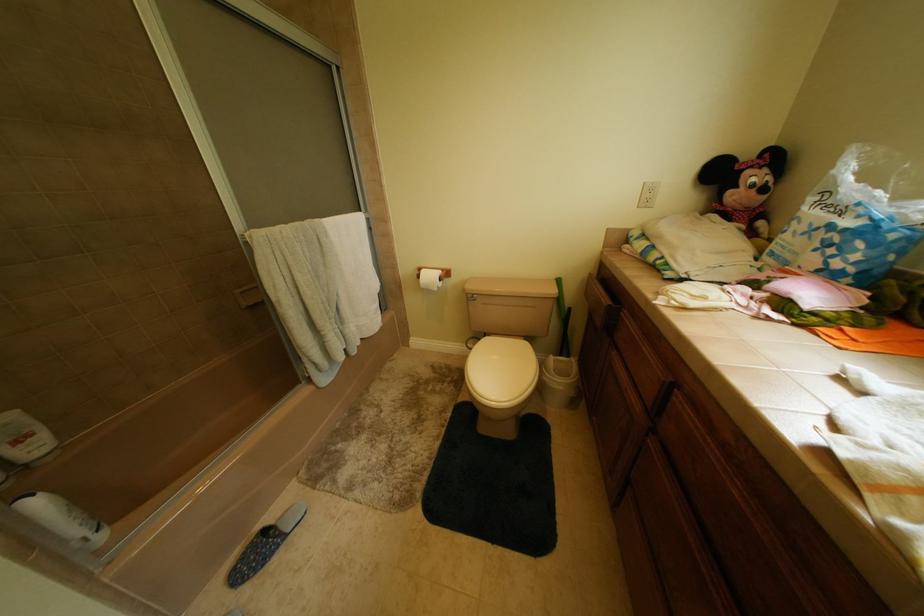
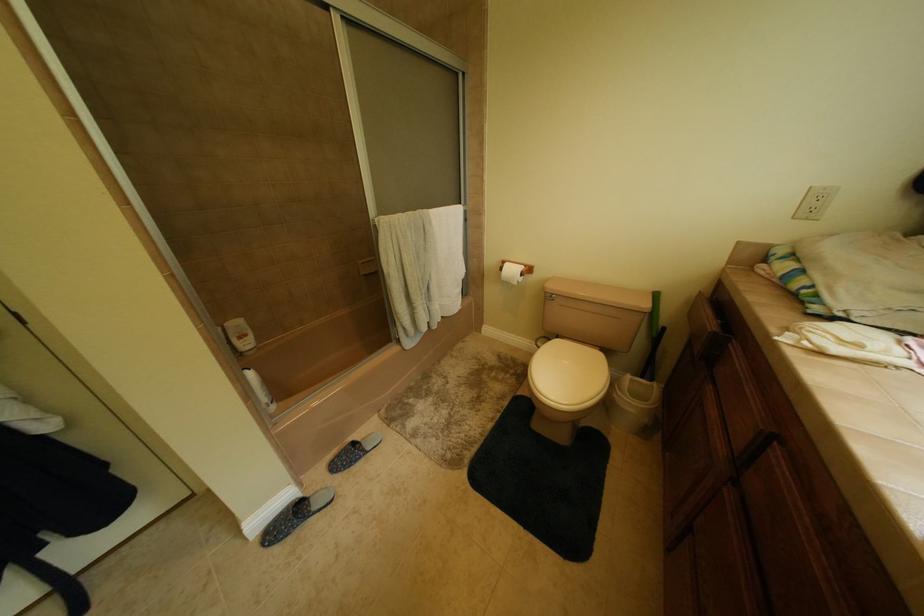
Question: What movement of the cameraman would produce the second image?

Choices:
 (A) Left
 (B) Right
 (C) Forward
 (D) Backward

Answer: (D)